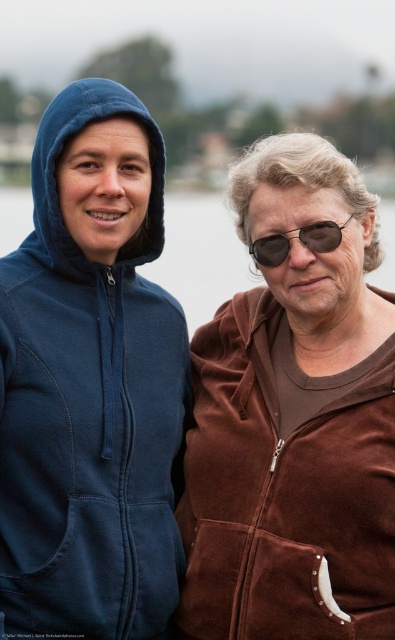
Question: Is matte blue hoodie at left above brown suede jacket at right?

Choices:
 (A) yes
 (B) no

Answer: (A)

Question: Which point appears farthest from the camera in this image?

Choices:
 (A) (225, 516)
 (B) (261, 244)
 (C) (114, 406)

Answer: (B)

Question: Among these objects, which one is nearest to the camera?

Choices:
 (A) sunglasses at right
 (B) brown suede jacket at right

Answer: (B)

Question: Is matte blue hoodie at left smaller than brown suede jacket at right?

Choices:
 (A) yes
 (B) no

Answer: (B)

Question: Can you confirm if brown suede jacket at right is positioned above sunglasses at right?

Choices:
 (A) no
 (B) yes

Answer: (A)

Question: Estimate the real-world distances between objects in this image. Which object is farther from the sunglasses at right?

Choices:
 (A) brown suede jacket at right
 (B) matte blue hoodie at left

Answer: (A)